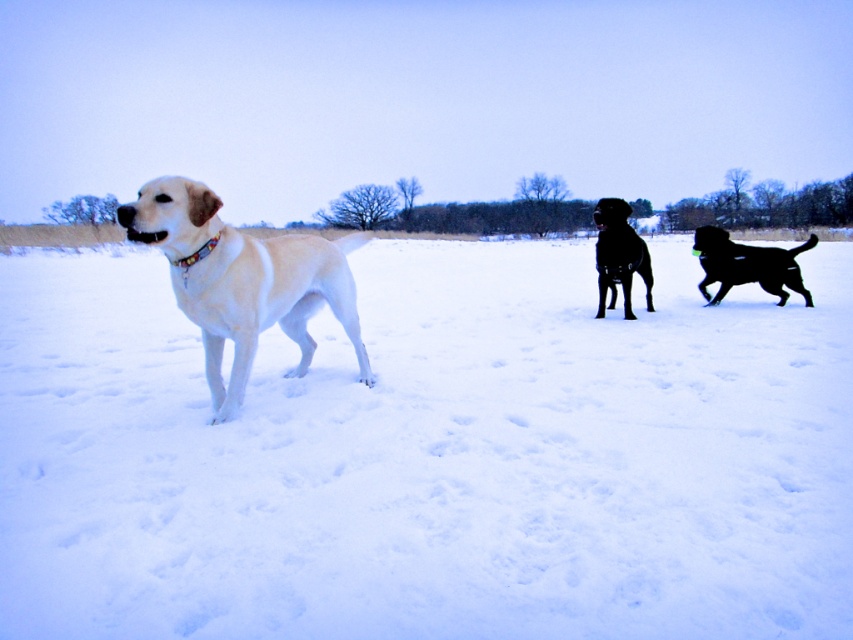
The image size is (853, 640). Describe the element at coordinates (430, 456) in the screenshot. I see `white fluffy snow at center` at that location.

Looking at this image, can you confirm if white fluffy snow at center is positioned to the right of shiny golden retriever at left?

In fact, white fluffy snow at center is to the left of shiny golden retriever at left.

Is point (59, 289) positioned in front of point (192, 198)?

No, (59, 289) is behind (192, 198).

This screenshot has width=853, height=640. Identify the location of white fluffy snow at center. (430, 456).

Can you confirm if shiny black dog at right is taller than shiny black dog at center?

Incorrect, shiny black dog at right's height is not larger of shiny black dog at center's.

This screenshot has width=853, height=640. I want to click on shiny black dog at right, so click(x=747, y=264).

Which of these two, white fluffy snow at center or shiny black dog at right, stands shorter?

shiny black dog at right

Which is behind, point (543, 257) or point (769, 272)?

The point (543, 257) is behind.

Where is `white fluffy snow at center`? Image resolution: width=853 pixels, height=640 pixels. white fluffy snow at center is located at coordinates (430, 456).